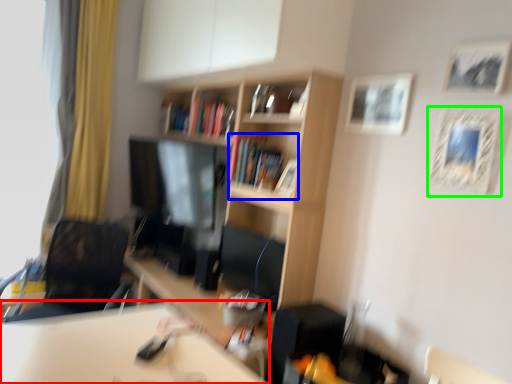
Question: Based on their relative distances, which object is farther from table (highlighted by a red box)? Choose from book (highlighted by a blue box) and picture frame (highlighted by a green box).

Choices:
 (A) book
 (B) picture frame

Answer: (B)